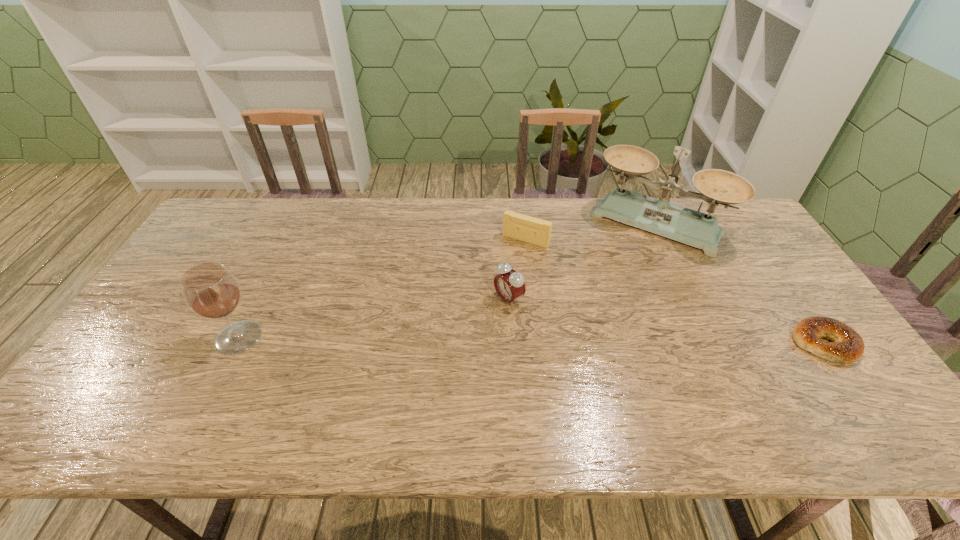
Locate an element on the screen. Image resolution: width=960 pixels, height=540 pixels. free space between the third shortest object and the fourth tallest object is located at coordinates (517, 269).

Image resolution: width=960 pixels, height=540 pixels. I want to click on vacant area that lies between the leftmost object and the alarm clock, so click(x=373, y=319).

In order to click on vacant space that's between the wineglass and the alarm clock in this screenshot , I will do `click(373, 319)`.

Where is `free space between the second shortest object and the third nearest object`? This screenshot has width=960, height=540. free space between the second shortest object and the third nearest object is located at coordinates (517, 269).

You are a GUI agent. You are given a task and a screenshot of the screen. Output one action in this format:
    pyautogui.click(x=<x>, y=<y>)
    Task: Click on the empty space that is in between the tallest object and the videotape
    The width and height of the screenshot is (960, 540).
    Given the screenshot: What is the action you would take?
    pyautogui.click(x=591, y=233)

At what (x,y) coordinates should I click in order to perform the action: click on free space between the third tallest object and the fourth tallest object. Please return your answer as a coordinate pair (x, y). Looking at the image, I should click on (517, 269).

Find the location of `vacant space in between the bagel and the tallest object`. vacant space in between the bagel and the tallest object is located at coordinates (740, 284).

At what (x,y) coordinates should I click in order to perform the action: click on empty space that is in between the third nearest object and the bagel. Please return your answer as a coordinate pair (x, y). Image resolution: width=960 pixels, height=540 pixels. Looking at the image, I should click on (666, 321).

I want to click on free space that is in between the fourth tallest object and the bagel, so click(x=675, y=292).

The width and height of the screenshot is (960, 540). What are the coordinates of `object that is the fourth closest to the third shortest object` in the screenshot? It's located at (847, 345).